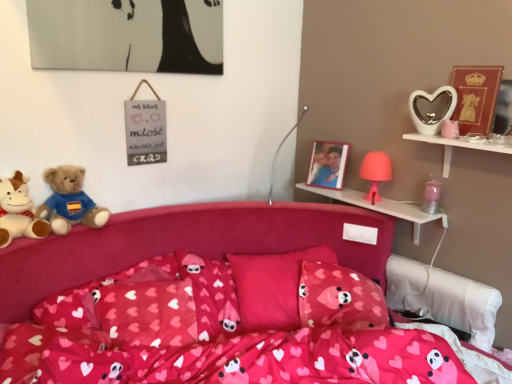
Question: Could you tell me if matte gold picture frame at upper right, which is counted as the first picture frame, starting from the front, is turned towards soft plush teddy bear at left, which is counted as the second teddy bear, starting from the right?

Choices:
 (A) no
 (B) yes

Answer: (A)

Question: Is matte gold picture frame at upper right, arranged as the 2th picture frame when viewed from the left, oriented away from soft plush teddy bear at left, the first teddy bear when ordered from left to right?

Choices:
 (A) yes
 (B) no

Answer: (B)

Question: Considering the relative positions of matte gold picture frame at upper right, which is counted as the first picture frame, starting from the front, and soft plush teddy bear at left, the first teddy bear when ordered from left to right, in the image provided, is matte gold picture frame at upper right, which is counted as the first picture frame, starting from the front, to the left of soft plush teddy bear at left, the first teddy bear when ordered from left to right, from the viewer's perspective?

Choices:
 (A) yes
 (B) no

Answer: (B)

Question: Considering the relative sizes of matte gold picture frame at upper right, positioned as the second picture frame in back-to-front order, and soft plush teddy bear at left, which is counted as the second teddy bear, starting from the right, in the image provided, is matte gold picture frame at upper right, positioned as the second picture frame in back-to-front order, wider than soft plush teddy bear at left, which is counted as the second teddy bear, starting from the right,?

Choices:
 (A) no
 (B) yes

Answer: (A)

Question: Considering the relative positions of matte gold picture frame at upper right, the first picture frame in the right-to-left sequence, and soft plush teddy bear at left, the first teddy bear when ordered from left to right, in the image provided, is matte gold picture frame at upper right, the first picture frame in the right-to-left sequence, in front of soft plush teddy bear at left, the first teddy bear when ordered from left to right,?

Choices:
 (A) no
 (B) yes

Answer: (A)

Question: From their relative heights in the image, would you say matte pink lamp at upper right, placed as the third toy when sorted from top to bottom, is taller or shorter than wooden photo frame at upper right, the first picture frame in the left-to-right sequence?

Choices:
 (A) short
 (B) tall

Answer: (A)

Question: From a real-world perspective, is matte pink lamp at upper right, which is counted as the second toy, starting from the bottom, physically located above or below wooden photo frame at upper right, placed as the second picture frame when sorted from front to back?

Choices:
 (A) above
 (B) below

Answer: (B)

Question: Would you say matte pink lamp at upper right, placed as the third toy when sorted from top to bottom, is inside or outside wooden photo frame at upper right, the first picture frame in the left-to-right sequence?

Choices:
 (A) outside
 (B) inside

Answer: (A)

Question: Is point (373, 177) closer or farther from the camera than point (320, 148)?

Choices:
 (A) farther
 (B) closer

Answer: (B)

Question: Looking at the image, does wooden photo frame at upper right, the first picture frame in the left-to-right sequence, seem bigger or smaller compared to white glossy heart-shaped object at upper right, which is the fourth toy from bottom to top?

Choices:
 (A) small
 (B) big

Answer: (B)

Question: Is wooden photo frame at upper right, the 1th picture frame from the back, to the left or to the right of white glossy heart-shaped object at upper right, which is the fourth toy from bottom to top, in the image?

Choices:
 (A) left
 (B) right

Answer: (A)

Question: In terms of height, does wooden photo frame at upper right, the 1th picture frame from the back, look taller or shorter compared to white glossy heart-shaped object at upper right, which is the fourth toy from bottom to top?

Choices:
 (A) tall
 (B) short

Answer: (A)

Question: Is wooden photo frame at upper right, placed as the second picture frame when sorted from front to back, inside or outside of white glossy heart-shaped object at upper right, which is the fourth toy from bottom to top?

Choices:
 (A) outside
 (B) inside

Answer: (A)

Question: Considering their positions, is white glossy heart-shaped object at upper right, marked as the first shelf in a front-to-back arrangement, located in front of or behind matte pink lamp at upper right, placed as the third toy when sorted from top to bottom?

Choices:
 (A) front
 (B) behind

Answer: (A)

Question: Looking at their shapes, would you say white glossy heart-shaped object at upper right, which ranks as the 2th shelf in back-to-front order, is wider or thinner than matte pink lamp at upper right, placed as the third toy when sorted from top to bottom?

Choices:
 (A) thin
 (B) wide

Answer: (B)